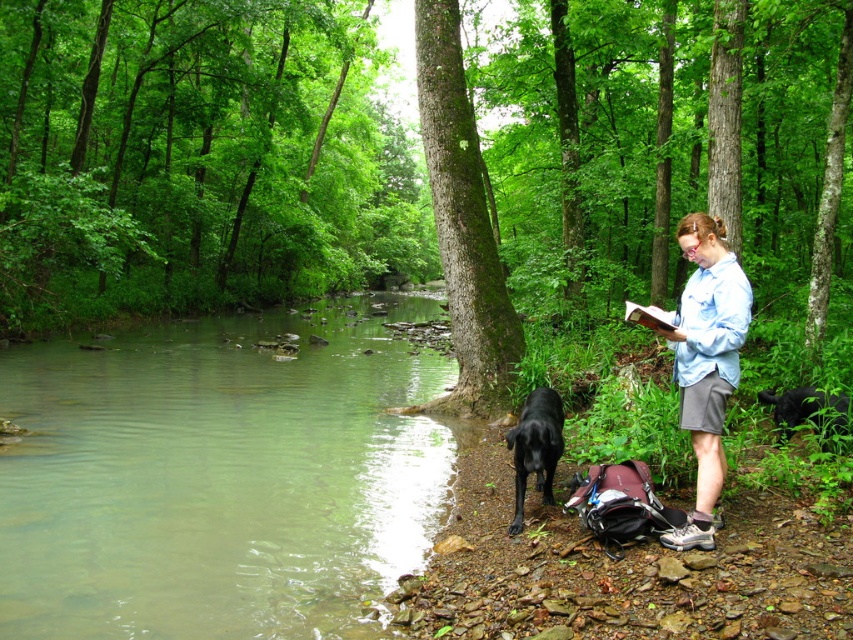
Question: Is green translucent water at center thinner than light blue shirt at center?

Choices:
 (A) yes
 (B) no

Answer: (B)

Question: Can you confirm if green leafy trees at upper center is wider than black smooth dog at lower center?

Choices:
 (A) no
 (B) yes

Answer: (B)

Question: Estimate the real-world distances between objects in this image. Which object is farther from the green translucent water at center?

Choices:
 (A) black smooth dog at lower center
 (B) green leafy trees at upper center
 (C) light blue shirt at center

Answer: (B)

Question: Which object appears closest to the camera in this image?

Choices:
 (A) black furry dog at lower right
 (B) light blue shirt at center
 (C) green translucent water at center

Answer: (C)

Question: Which point is farther to the camera?

Choices:
 (A) (541, 148)
 (B) (817, 397)
 (C) (732, 339)
 (D) (525, 440)

Answer: (A)

Question: Can you confirm if green translucent water at center is thinner than black furry dog at lower right?

Choices:
 (A) yes
 (B) no

Answer: (B)